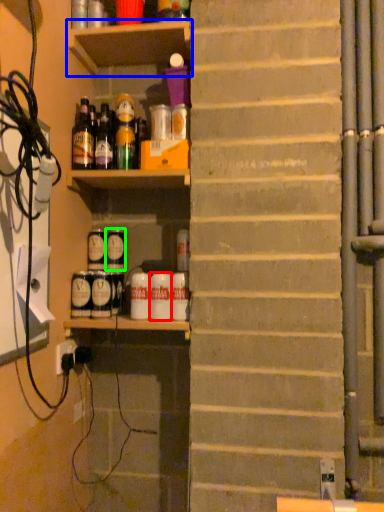
Question: Considering the real-world distances, which object is farthest from beverage (highlighted by a red box)? shelf (highlighted by a blue box) or beverage (highlighted by a green box)?

Choices:
 (A) shelf
 (B) beverage

Answer: (A)